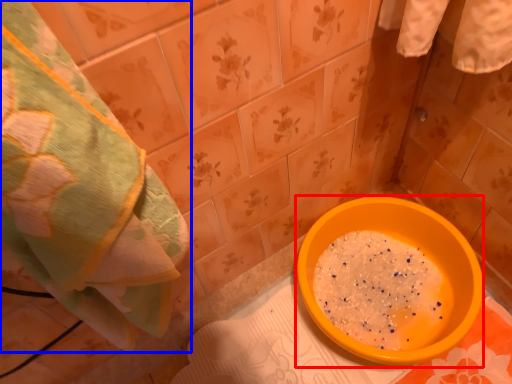
Question: Which of the following is the farthest to the observer, basin (highlighted by a red box) or towel (highlighted by a blue box)?

Choices:
 (A) basin
 (B) towel

Answer: (A)